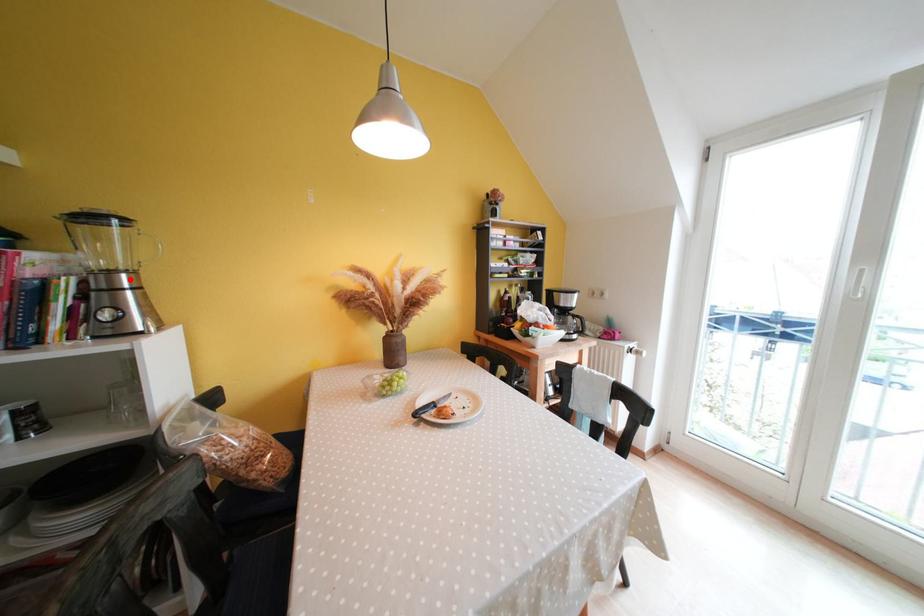
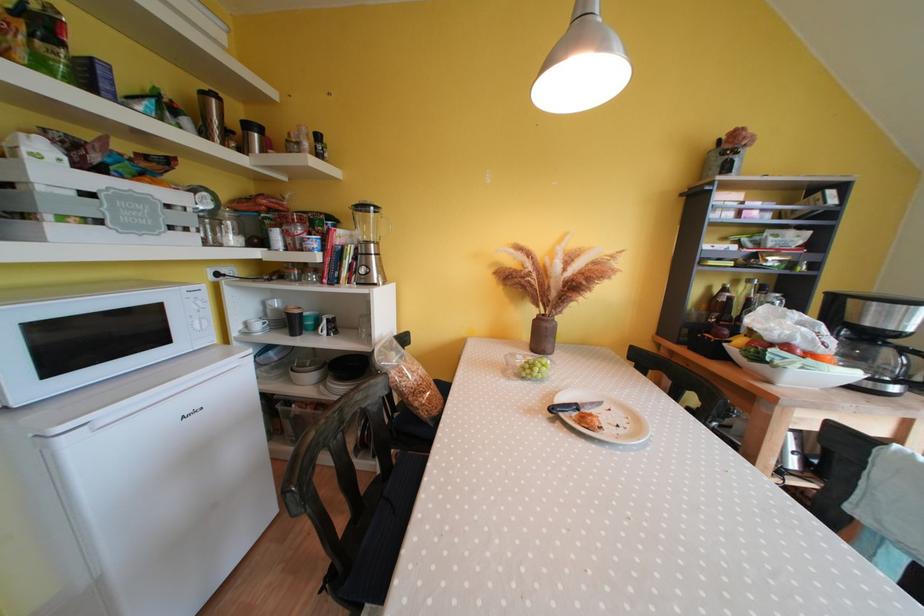
In the second image, find the point that corresponds to the highlighted location in the first image.

(379, 249)